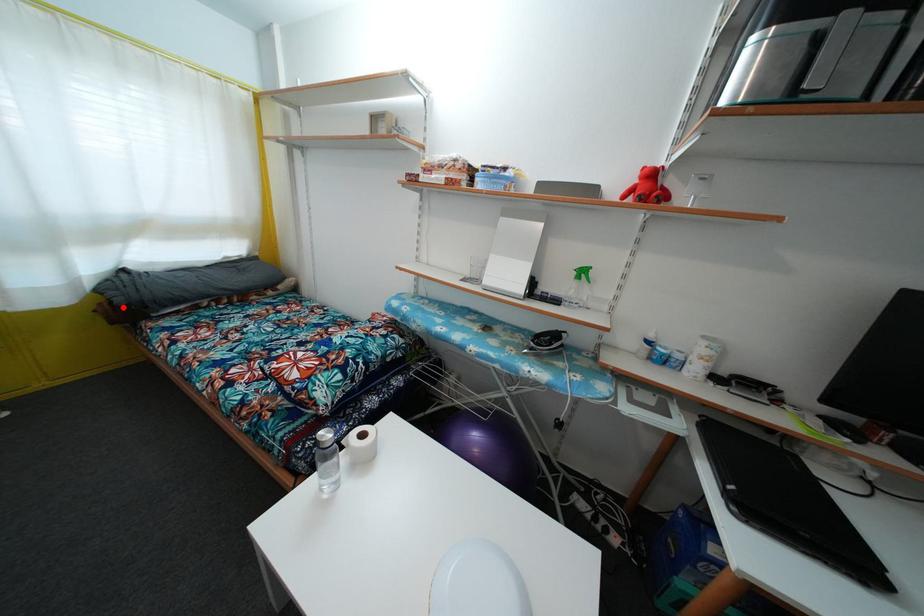
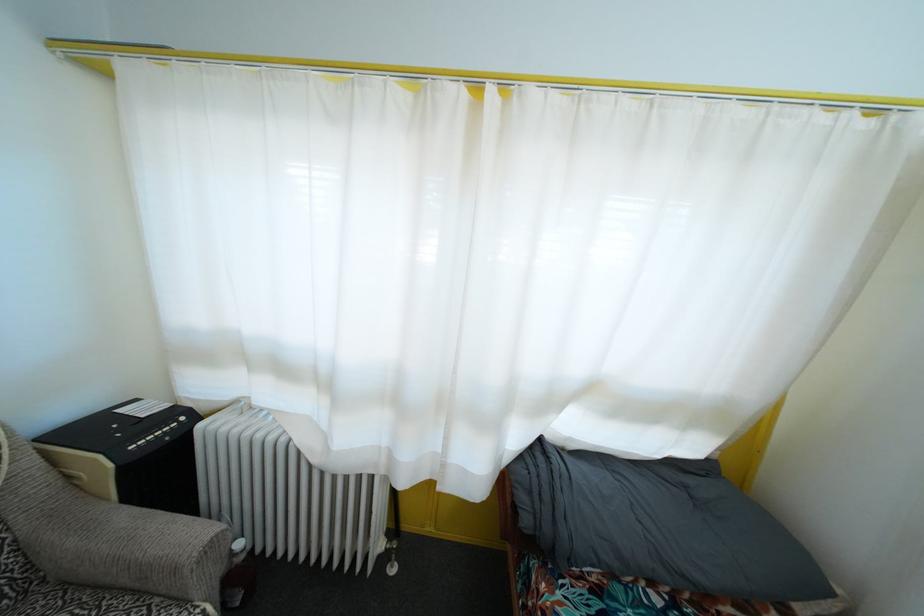
Where in the second image is the point corresponding to the highlighted location from the first image?

(529, 528)